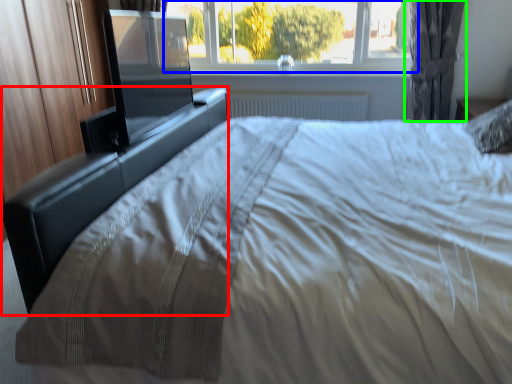
Question: Based on their relative distances, which object is nearer to bed frame (highlighted by a red box)? Choose from window (highlighted by a blue box) and curtain (highlighted by a green box).

Choices:
 (A) window
 (B) curtain

Answer: (A)